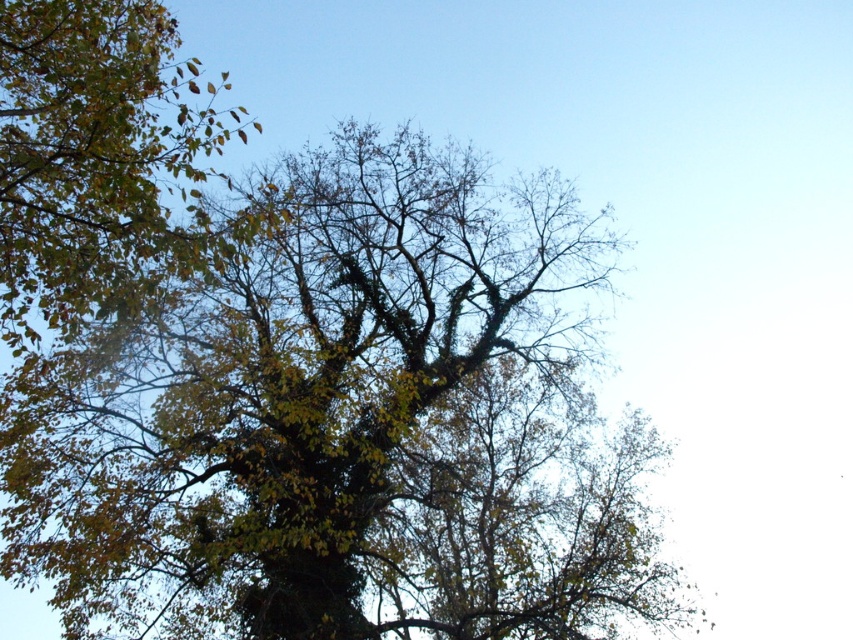
Question: Can you confirm if green leafy oak tree at center is bigger than green leafy tree at upper left?

Choices:
 (A) yes
 (B) no

Answer: (A)

Question: Can you confirm if green leafy oak tree at center is bigger than green leafy tree at upper left?

Choices:
 (A) yes
 (B) no

Answer: (A)

Question: Is green leafy oak tree at center thinner than green leafy tree at upper left?

Choices:
 (A) yes
 (B) no

Answer: (B)

Question: Which of the following is the closest to the observer?

Choices:
 (A) pyautogui.click(x=12, y=20)
 (B) pyautogui.click(x=56, y=452)

Answer: (A)

Question: Which of the following is the closest to the observer?

Choices:
 (A) (123, 35)
 (B) (325, 404)

Answer: (A)

Question: Among these points, which one is farthest from the camera?

Choices:
 (A) (631, 444)
 (B) (199, 156)

Answer: (A)